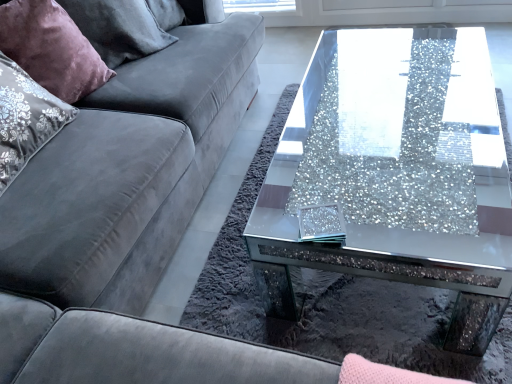
Question: Is velvet grey couch at left in front of or behind sparkly glass coffee table at center in the image?

Choices:
 (A) front
 (B) behind

Answer: (A)

Question: From a real-world perspective, is velvet grey couch at left positioned above or below sparkly glass coffee table at center?

Choices:
 (A) below
 (B) above

Answer: (B)

Question: Considering the real-world distances, which object is farthest from the velvet purple pillow at upper left?

Choices:
 (A) sparkly glass coffee table at center
 (B) velvet grey couch at left

Answer: (A)

Question: Based on their relative distances, which object is nearer to the sparkly glass coffee table at center?

Choices:
 (A) velvet grey couch at left
 (B) velvet purple pillow at upper left

Answer: (A)